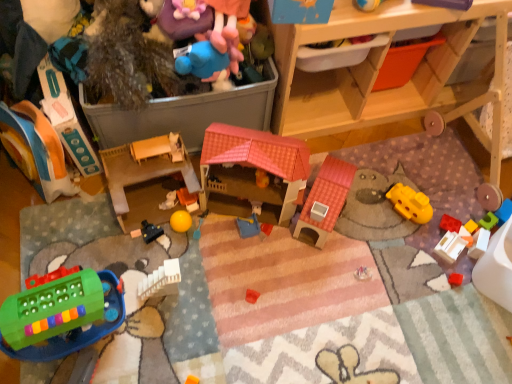
Image resolution: width=512 pixels, height=384 pixels. Identify the location of free space in front of white plastic toy at lower right, which is counted as the tenth toy, starting from the left. (451, 297).